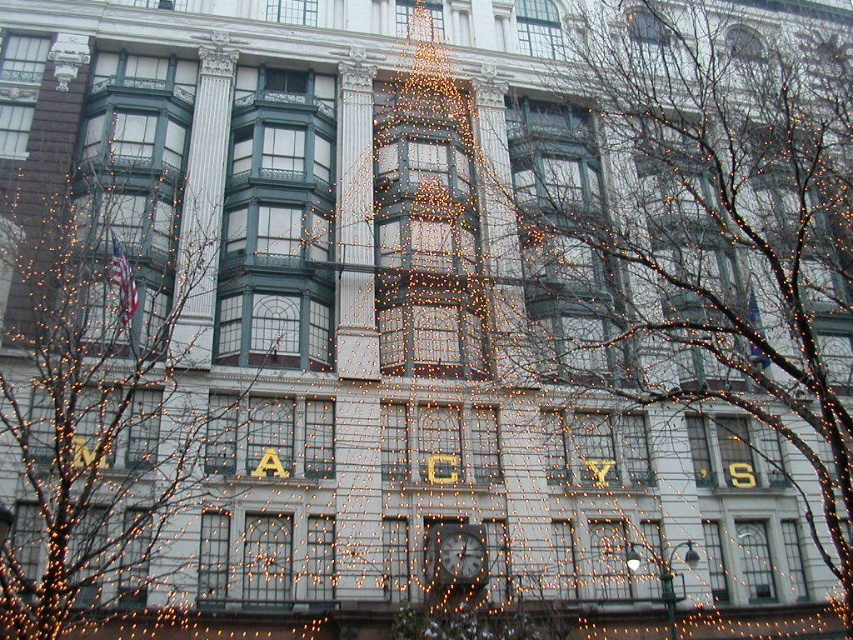
Who is more forward, [740,232] or [102,333]?

Point [102,333]

Measure the distance between point (737, 276) and camera.

They are 74.53 meters apart.

The image size is (853, 640). I want to click on bare branches at center, so click(x=717, y=218).

Can you confirm if bare branches at center is positioned to the right of metallic clock at center?

Indeed, bare branches at center is positioned on the right side of metallic clock at center.

Is bare branches at center wider than metallic clock at center?

Yes, bare branches at center is wider than metallic clock at center.

Is point (547, 244) farther from camera compared to point (456, 541)?

That is True.

Identify the location of bare branches at center. The width and height of the screenshot is (853, 640). (717, 218).

Between illuminated wireframe tree at center and metallic clock at center, which one is positioned higher?

illuminated wireframe tree at center

This screenshot has width=853, height=640. I want to click on illuminated wireframe tree at center, so click(x=96, y=420).